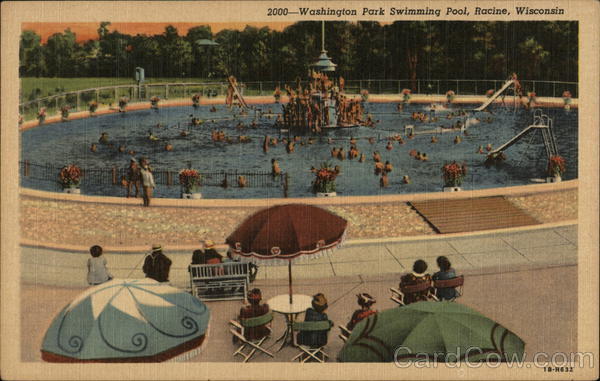
Where is `table`? This screenshot has width=600, height=381. table is located at coordinates (291, 305).